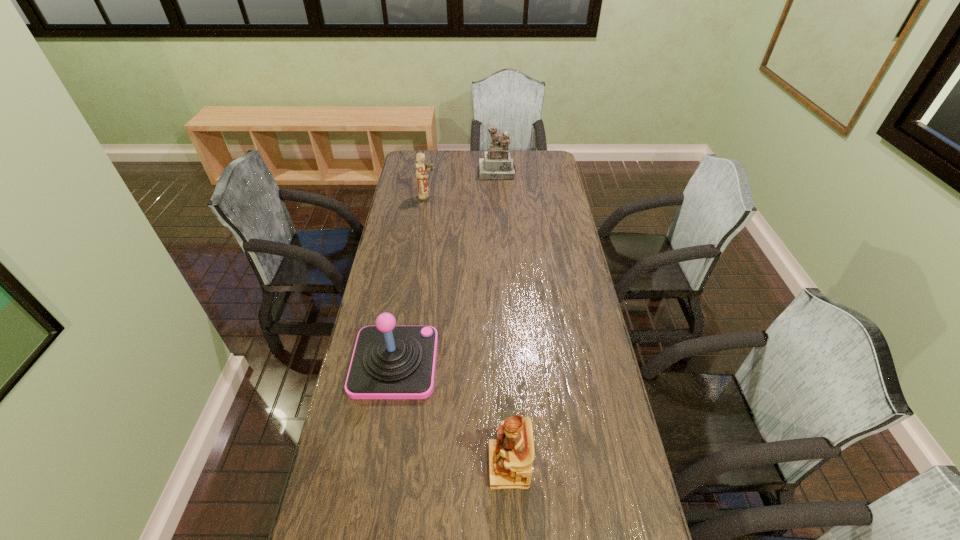
Where is `the farthest object`? The image size is (960, 540). the farthest object is located at coordinates (497, 164).

At what (x,y) coordinates should I click in order to perform the action: click on the leftmost figurine. Please return your answer as a coordinate pair (x, y). This screenshot has width=960, height=540. Looking at the image, I should click on point(424,195).

The width and height of the screenshot is (960, 540). I want to click on the second nearest figurine, so click(424, 195).

In order to click on the nearest figurine in this screenshot , I will do `click(511, 455)`.

At what (x,y) coordinates should I click in order to perform the action: click on the second nearest object. Please return your answer as a coordinate pair (x, y). Looking at the image, I should click on (389, 362).

Locate an element on the screen. Image resolution: width=960 pixels, height=540 pixels. free point located 0.110m on the front-facing side of the farthest figurine is located at coordinates (498, 192).

I want to click on free space located on the front-facing side of the third nearest object, so click(x=498, y=198).

Locate an element on the screen. The image size is (960, 540). free space located on the front-facing side of the nearest figurine is located at coordinates (469, 465).

Where is `free region located on the front-facing side of the nearest figurine`? This screenshot has height=540, width=960. free region located on the front-facing side of the nearest figurine is located at coordinates (443, 465).

This screenshot has height=540, width=960. Find the location of `blank space located on the front-facing side of the nearest figurine`. blank space located on the front-facing side of the nearest figurine is located at coordinates (370, 465).